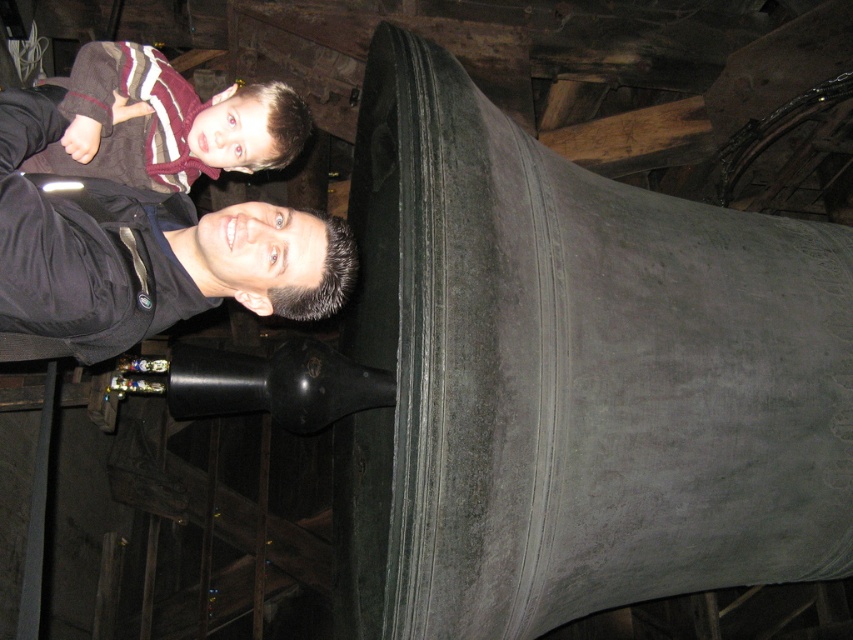
Question: Which of the following is the farthest from the observer?

Choices:
 (A) (196, 308)
 (B) (183, 108)

Answer: (B)

Question: Which point is farther to the camera?

Choices:
 (A) matte black shirt at upper left
 (B) matte black jacket at lower left

Answer: (A)

Question: Considering the relative positions of matte black jacket at lower left and matte black shirt at upper left in the image provided, where is matte black jacket at lower left located with respect to matte black shirt at upper left?

Choices:
 (A) above
 (B) below

Answer: (B)

Question: Can you confirm if matte black jacket at lower left is bigger than matte black shirt at upper left?

Choices:
 (A) no
 (B) yes

Answer: (B)

Question: Is matte black jacket at lower left to the left of matte black shirt at upper left from the viewer's perspective?

Choices:
 (A) yes
 (B) no

Answer: (B)

Question: Which point appears farthest from the camera in this image?

Choices:
 (A) (54, 200)
 (B) (86, 156)

Answer: (B)